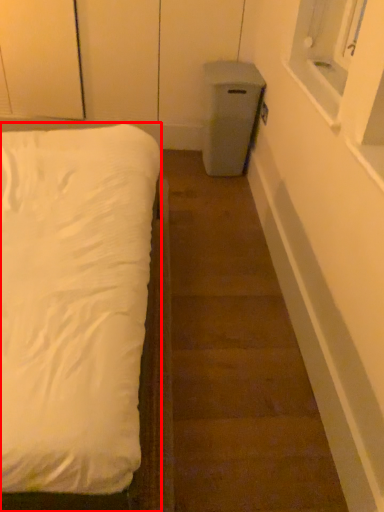
Question: In this image, where is bed (annotated by the red box) located relative to stairwell?

Choices:
 (A) left
 (B) right

Answer: (A)